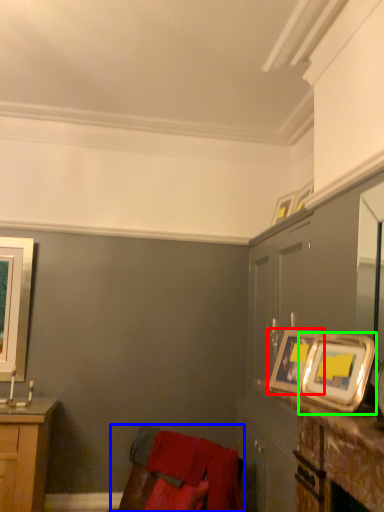
Question: Which object is the farthest from picture frame (highlighted by a red box)? Choose among these: swivel chair (highlighted by a blue box) or picture frame (highlighted by a green box).

Choices:
 (A) swivel chair
 (B) picture frame

Answer: (A)